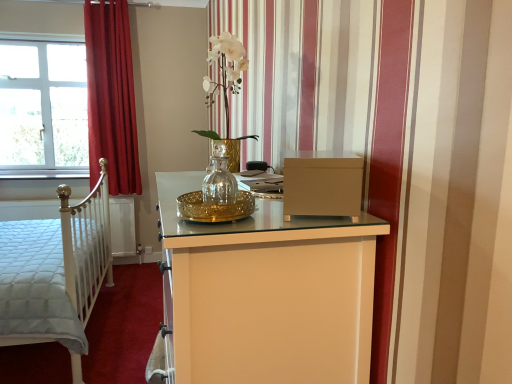
Question: Does clear glass vase at center have a greater width compared to white quilted fabric bed at left?

Choices:
 (A) no
 (B) yes

Answer: (A)

Question: From a real-world perspective, is clear glass vase at center physically below white quilted fabric bed at left?

Choices:
 (A) yes
 (B) no

Answer: (B)

Question: Considering the relative sizes of clear glass vase at center and white quilted fabric bed at left in the image provided, is clear glass vase at center taller than white quilted fabric bed at left?

Choices:
 (A) no
 (B) yes

Answer: (A)

Question: Does clear glass vase at center have a larger size compared to white quilted fabric bed at left?

Choices:
 (A) no
 (B) yes

Answer: (A)

Question: From the image's perspective, is clear glass vase at center under white quilted fabric bed at left?

Choices:
 (A) yes
 (B) no

Answer: (B)

Question: From a real-world perspective, is white glass window at upper left above or below matte brown file cabinet at center?

Choices:
 (A) above
 (B) below

Answer: (A)

Question: Is point (14, 170) positioned closer to the camera than point (315, 155)?

Choices:
 (A) farther
 (B) closer

Answer: (A)

Question: Is white glass window at upper left spatially inside matte brown file cabinet at center, or outside of it?

Choices:
 (A) inside
 (B) outside

Answer: (B)

Question: From the image's perspective, is white glass window at upper left positioned above or below matte brown file cabinet at center?

Choices:
 (A) above
 (B) below

Answer: (A)

Question: Is clear glass vase at center bigger or smaller than white glass window at upper left?

Choices:
 (A) big
 (B) small

Answer: (B)

Question: Looking at their shapes, would you say clear glass vase at center is wider or thinner than white glass window at upper left?

Choices:
 (A) wide
 (B) thin

Answer: (A)

Question: From a real-world perspective, relative to white glass window at upper left, is clear glass vase at center vertically above or below?

Choices:
 (A) below
 (B) above

Answer: (A)

Question: Is clear glass vase at center inside or outside of white glass window at upper left?

Choices:
 (A) outside
 (B) inside

Answer: (A)

Question: From the image's perspective, relative to red velvet curtain at left, is matte brown file cabinet at center above or below?

Choices:
 (A) below
 (B) above

Answer: (A)

Question: Looking at their shapes, would you say matte brown file cabinet at center is wider or thinner than red velvet curtain at left?

Choices:
 (A) thin
 (B) wide

Answer: (A)